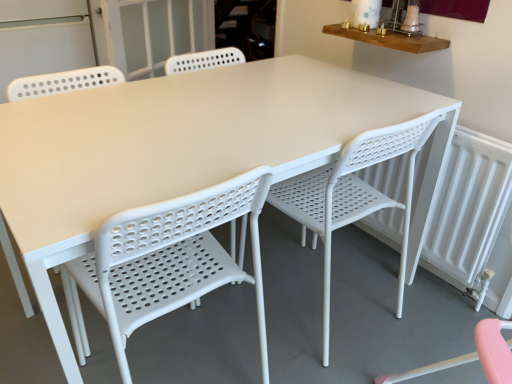
At what (x,y) coordinates should I click in order to perform the action: click on free space underneath white plastic radiator at right (from a real-world perspective). Please return your answer as a coordinate pair (x, y). Looking at the image, I should click on (415, 273).